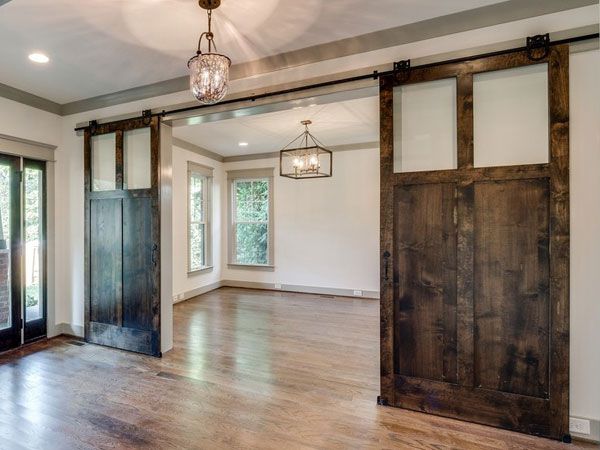
Locate an element on the screen. The image size is (600, 450). wooden floor is located at coordinates (335, 362).